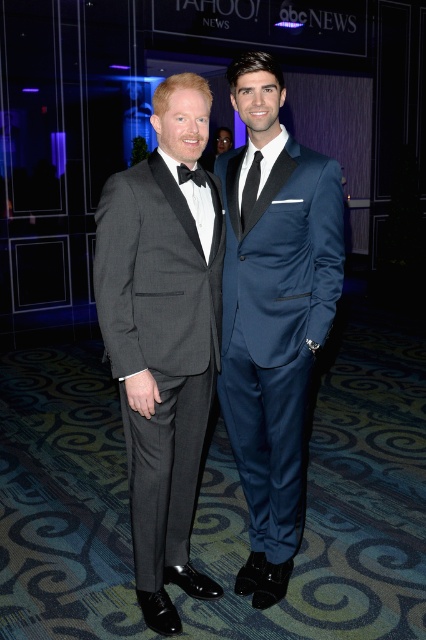
Is black satin tie at center wider than black satin bow tie at center?

Incorrect, black satin tie at center's width does not surpass black satin bow tie at center's.

Can you confirm if black satin tie at center is smaller than black satin bow tie at center?

No, black satin tie at center is not smaller than black satin bow tie at center.

This screenshot has height=640, width=426. I want to click on black satin tie at center, so point(250,188).

Who is higher up, satin blue suit at center or black satin bow tie at center?

Positioned higher is black satin bow tie at center.

Is point (311, 192) positioned before point (203, 182)?

No, (311, 192) is further to viewer.

Identify the location of satin blue suit at center. (273, 316).

Image resolution: width=426 pixels, height=640 pixels. What do you see at coordinates (273, 316) in the screenshot?
I see `satin blue suit at center` at bounding box center [273, 316].

Which is behind, point (282, 246) or point (245, 184)?

Point (245, 184)

Does point (331, 256) come behind point (245, 221)?

That is True.

Locate an element on the screen. The width and height of the screenshot is (426, 640). satin blue suit at center is located at coordinates (273, 316).